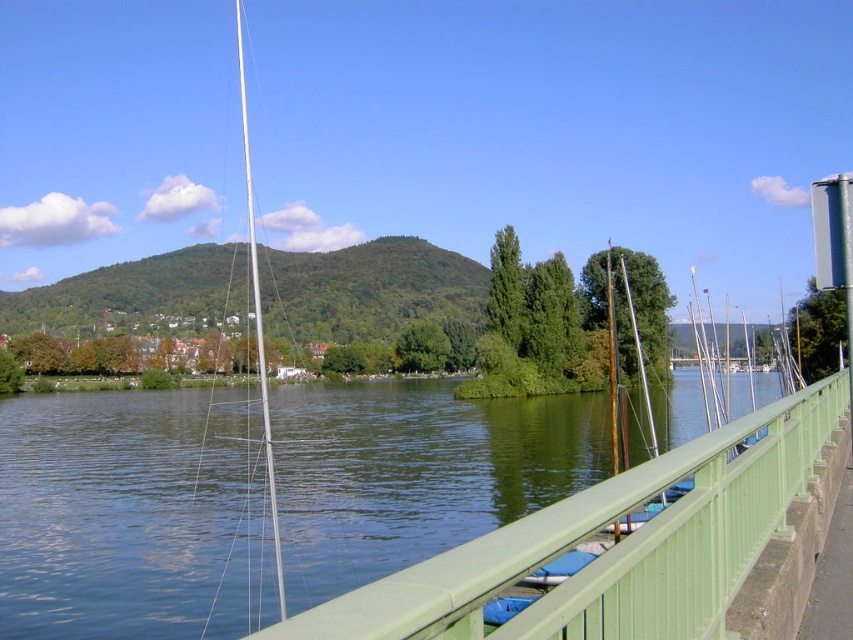
You are standing at point (614, 545) in the riverside scene. What object is located exactly at this coordinate?

The green painted metal railing at center is located exactly at point (614, 545).